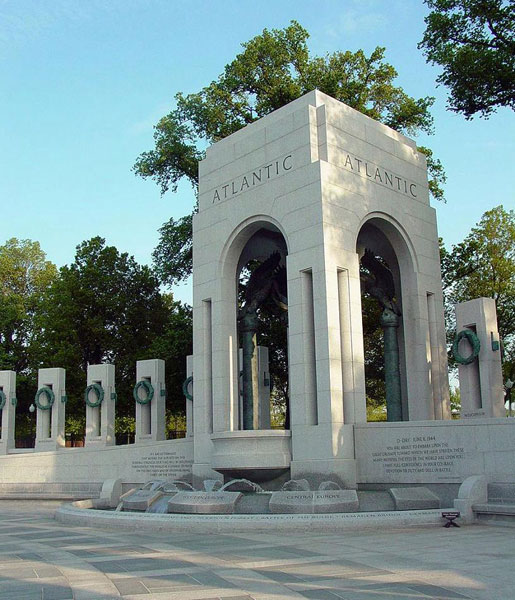
I want to click on wreath, so click(478, 345), click(46, 401), click(88, 402), click(138, 396), click(185, 385).